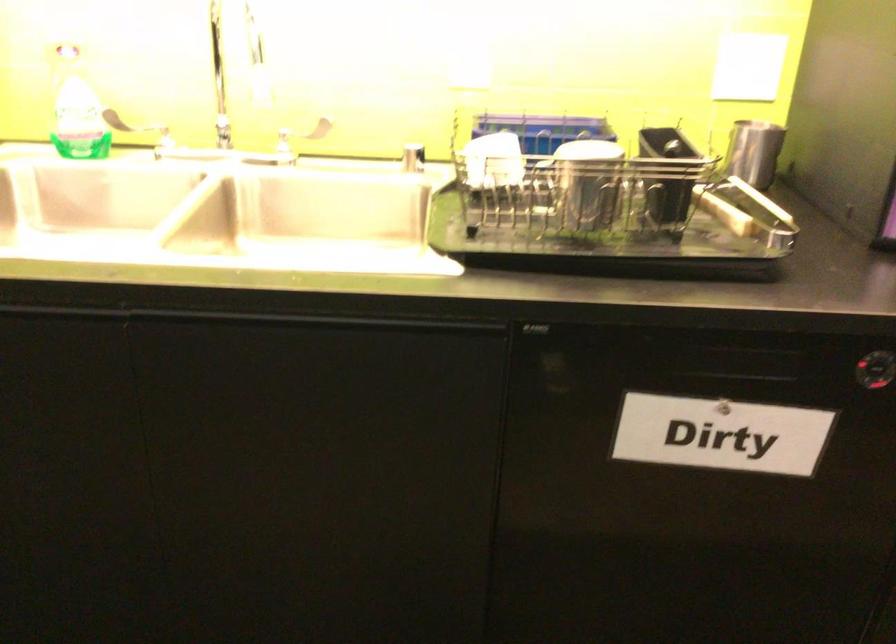
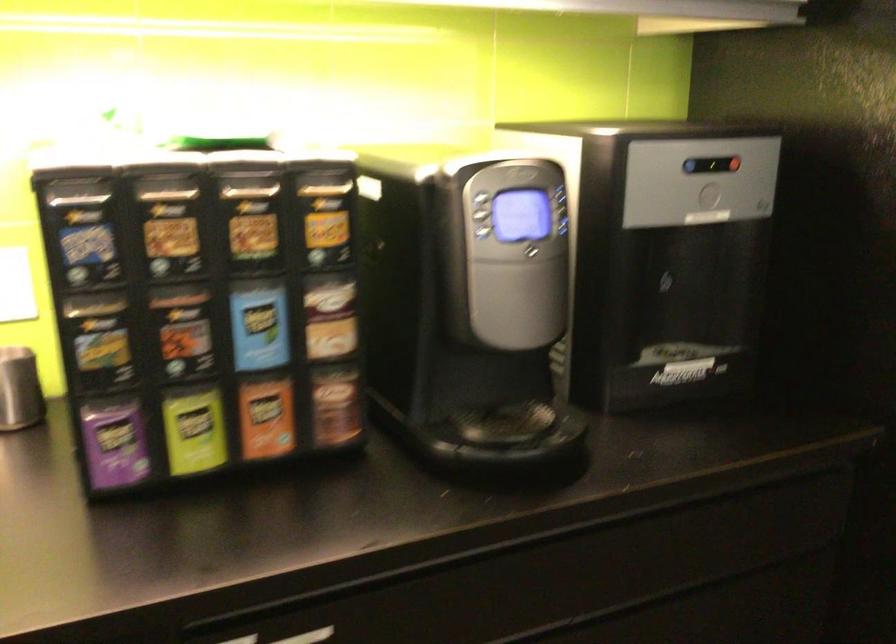
In the second image, find the point that corresponds to (x=770, y=153) in the first image.

(19, 389)